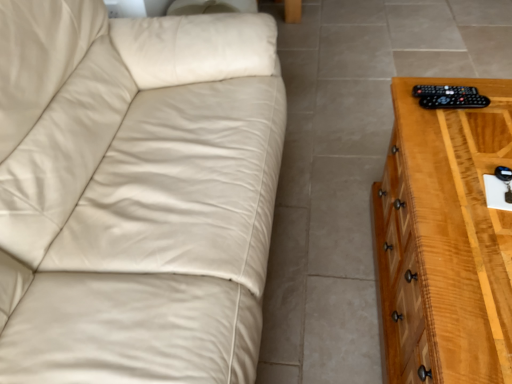
Question: Is black plastic remote at right aimed at black plastic remote at right?

Choices:
 (A) no
 (B) yes

Answer: (A)

Question: Does black plastic remote at right come in front of black plastic remote at right?

Choices:
 (A) yes
 (B) no

Answer: (A)

Question: Is black plastic remote at right bigger than black plastic remote at right?

Choices:
 (A) no
 (B) yes

Answer: (B)

Question: Is black plastic remote at right located outside black plastic remote at right?

Choices:
 (A) no
 (B) yes

Answer: (B)

Question: Is black plastic remote at right shorter than black plastic remote at right?

Choices:
 (A) yes
 (B) no

Answer: (B)

Question: Is black plastic remote at right situated inside light brown wooden chest of drawers at right or outside?

Choices:
 (A) outside
 (B) inside

Answer: (B)

Question: Does point (431, 87) appear closer or farther from the camera than point (442, 145)?

Choices:
 (A) closer
 (B) farther

Answer: (B)

Question: In terms of size, does black plastic remote at right appear bigger or smaller than light brown wooden chest of drawers at right?

Choices:
 (A) big
 (B) small

Answer: (B)

Question: Is black plastic remote at right wider or thinner than light brown wooden chest of drawers at right?

Choices:
 (A) thin
 (B) wide

Answer: (A)

Question: Is black plastic remote at right to the left or to the right of black plastic remote at right in the image?

Choices:
 (A) right
 (B) left

Answer: (A)

Question: Is black plastic remote at right wider or thinner than black plastic remote at right?

Choices:
 (A) wide
 (B) thin

Answer: (B)

Question: Is black plastic remote at right situated inside black plastic remote at right or outside?

Choices:
 (A) inside
 (B) outside

Answer: (B)

Question: Considering the positions of point (437, 94) and point (437, 107), is point (437, 94) closer or farther from the camera than point (437, 107)?

Choices:
 (A) farther
 (B) closer

Answer: (A)

Question: From the image's perspective, is black plastic remote at right above or below light brown wooden chest of drawers at right?

Choices:
 (A) below
 (B) above

Answer: (B)

Question: Considering the positions of black plastic remote at right and light brown wooden chest of drawers at right in the image, is black plastic remote at right bigger or smaller than light brown wooden chest of drawers at right?

Choices:
 (A) big
 (B) small

Answer: (B)